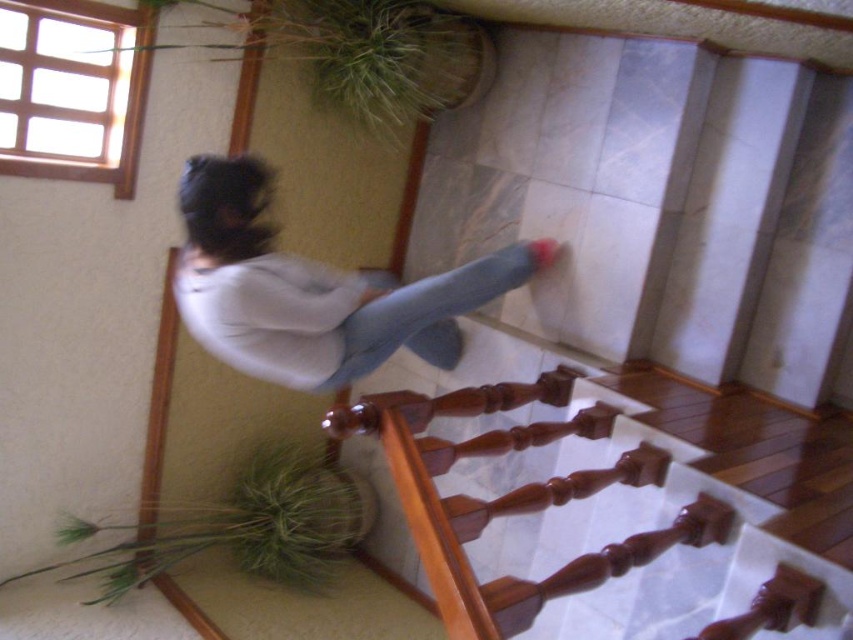
Is the position of wooden staircase at center less distant than that of light blue denim jeans at center?

Yes, wooden staircase at center is closer to the viewer.

Between point (700, 406) and point (210, 310), which one is positioned in front?

Point (210, 310) is in front.

Is point (614, 513) more distant than point (465, 276)?

No, (614, 513) is closer to viewer.

This screenshot has width=853, height=640. Identify the location of wooden staircase at center. click(624, 509).